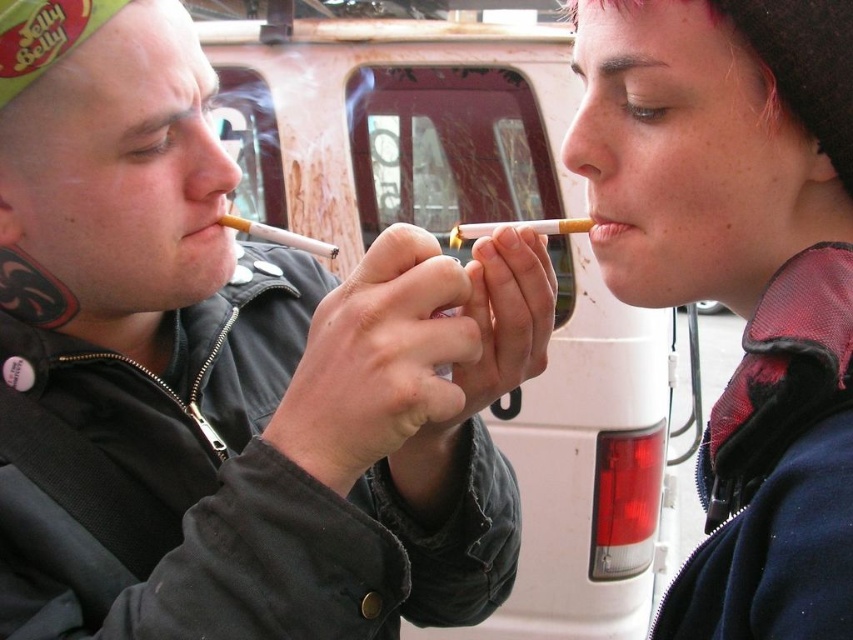
You are a photographer trying to capture a closeup of both the matte black jacket at upper right and the matte pink lipstick at mouth in the scene. Which object should you zoom in on to ensure both fit in the frame without cropping?

The matte black jacket at upper right is wider than the matte pink lipstick at mouth, so you should zoom in on the matte black jacket at upper right to ensure both fit in the frame without cropping.

You are a photographer setting up a closeup shot of the two people smoking. You need to ensure the white matte cigarette at center and the matte pink lipstick at mouth are both in focus. Given that your camera can only focus on objects wider than 2 cm, can both objects be in focus?

The white matte cigarette at center is wider than the matte pink lipstick at mouth. Since the cigarette is wider, if it meets the 2 cm requirement, the lipstick might not. However, without exact measurements, we can only confirm the cigarette is wider. But according to the description, the cigarette surpasses the lipstick in width. If the cigarette is over 2 cm, then both could be in focus if the lipstick is also over 2 cm. But since the exact width isn